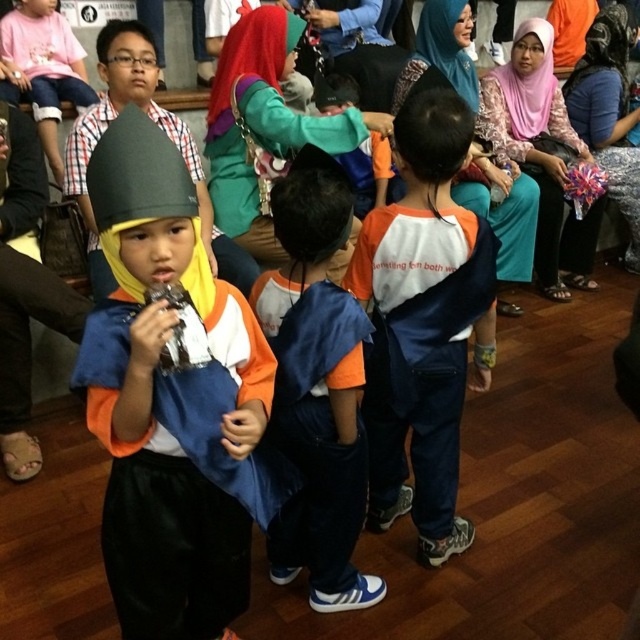
Question: Can you confirm if orange cotton shirt at center is smaller than orange cotton shirt at upper right?

Choices:
 (A) yes
 (B) no

Answer: (A)

Question: Which of the following is the farthest from the observer?

Choices:
 (A) (156, 148)
 (B) (541, 36)

Answer: (B)

Question: Among these points, which one is farthest from the camera?

Choices:
 (A) (131, 486)
 (B) (369, 253)

Answer: (B)

Question: Is matte black helmet at center wider than orange fabric shirt at center?

Choices:
 (A) yes
 (B) no

Answer: (B)

Question: Does orange cotton shirt at center have a lesser width compared to orange cotton shirt at upper right?

Choices:
 (A) no
 (B) yes

Answer: (B)

Question: Which object appears closest to the camera in this image?

Choices:
 (A) orange fabric shirt at center
 (B) matte black helmet at center

Answer: (B)